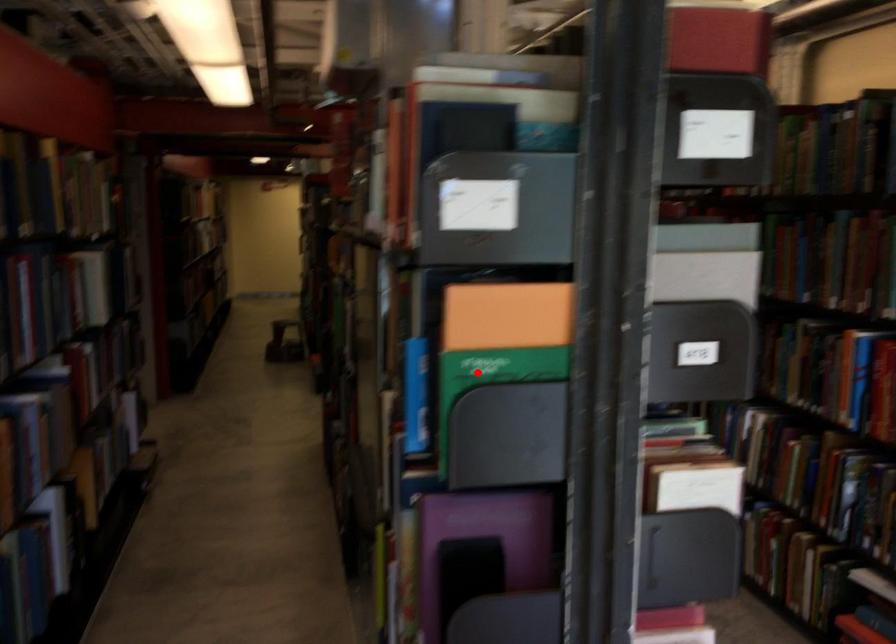
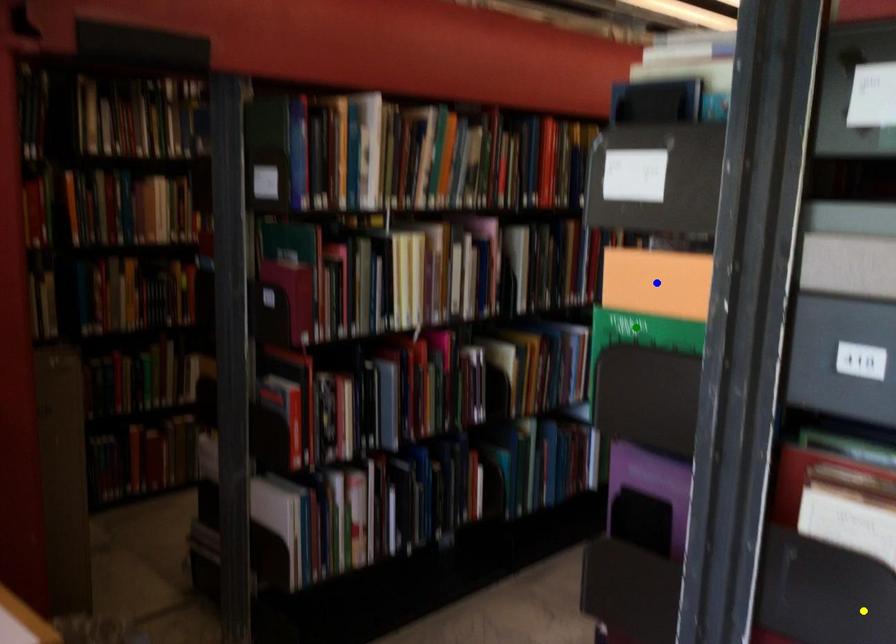
Question: I am providing you with two images of the same scene from different viewpoints. A red point is marked on the first image. You are given multiple points on the second image. Which point in image 2 represents the same 3d spot as the red point in image 1?

Choices:
 (A) yellow point
 (B) blue point
 (C) green point

Answer: (C)